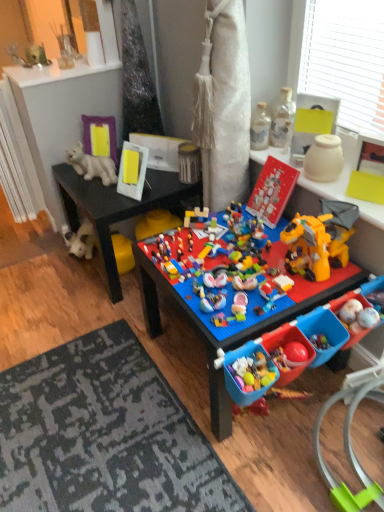
Find the location of a particular element. The width and height of the screenshot is (384, 512). free space in front of blue plastic table at center is located at coordinates (255, 456).